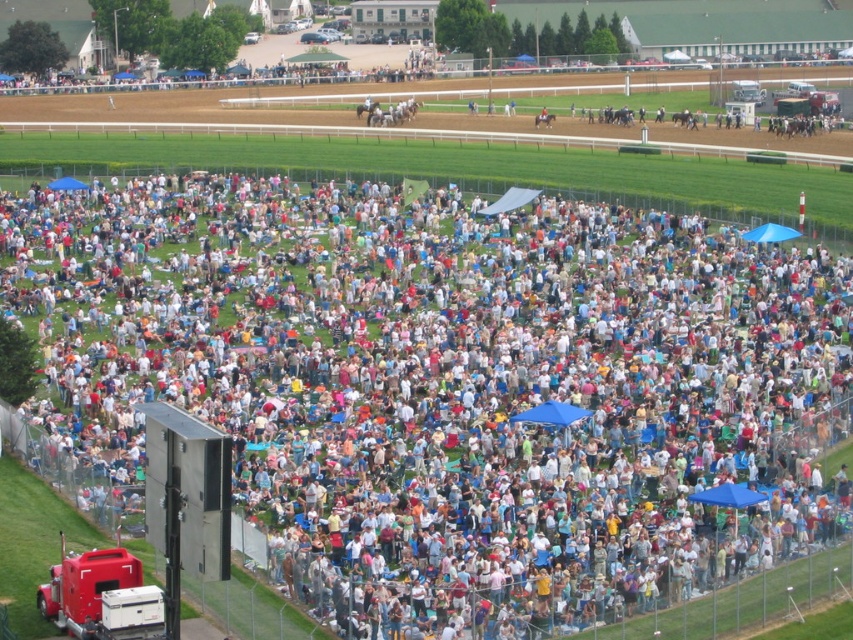
Question: Is red matte trailer truck at lower left behind brown glossy horse at center?

Choices:
 (A) no
 (B) yes

Answer: (A)

Question: Which point is farther to the camera?

Choices:
 (A) (113, 554)
 (B) (544, 365)
 (C) (534, 124)

Answer: (C)

Question: Which point appears farthest from the camera in this image?

Choices:
 (A) (485, 586)
 (B) (552, 120)
 (C) (91, 616)

Answer: (B)

Question: Is white casual clothing at center to the left of red matte trailer truck at lower left from the viewer's perspective?

Choices:
 (A) no
 (B) yes

Answer: (A)

Question: Which of these objects is positioned closest to the red matte trailer truck at lower left?

Choices:
 (A) white casual clothing at center
 (B) brown glossy horse at center

Answer: (A)

Question: Does red matte trailer truck at lower left have a larger size compared to brown glossy horse at center?

Choices:
 (A) no
 (B) yes

Answer: (B)